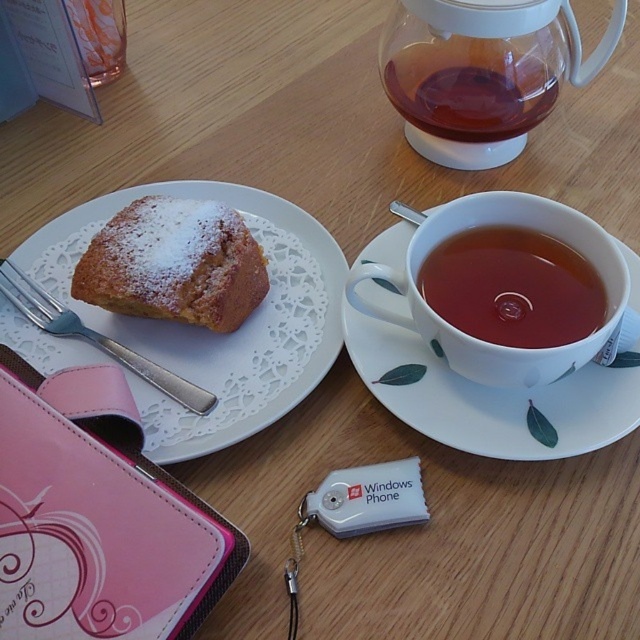
You are placing a small candle on the wooden table and want to ensure it doesn not block the view of the powdered sugar cake at left. Where should you place the candle?

You should place the candle to the right of the powdered sugar cake at left to avoid blocking its view.

Based on the coordinates given, where is the white ceramic saucer at upper right located in the image?

The white ceramic saucer at upper right is located at coordinates point (x=490, y=397) in the image.